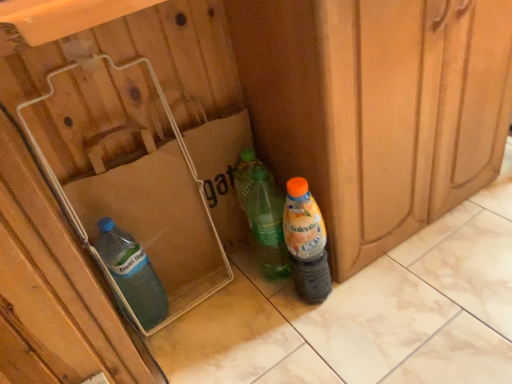
Question: Are translucent plastic bottle at lower right, the 1th bottle in the right-to-left sequence, and transparent plastic bottle at lower left, the 1th bottle positioned from the left, making contact?

Choices:
 (A) no
 (B) yes

Answer: (A)

Question: Is translucent plastic bottle at lower right, the second bottle positioned from the left, positioned far away from transparent plastic bottle at lower left, the 1th bottle positioned from the left?

Choices:
 (A) no
 (B) yes

Answer: (A)

Question: From the image's perspective, is translucent plastic bottle at lower right, the 1th bottle in the right-to-left sequence, below transparent plastic bottle at lower left, which appears as the second bottle when viewed from the right?

Choices:
 (A) yes
 (B) no

Answer: (B)

Question: Does translucent plastic bottle at lower right, the 1th bottle in the right-to-left sequence, have a larger size compared to transparent plastic bottle at lower left, the 1th bottle positioned from the left?

Choices:
 (A) yes
 (B) no

Answer: (A)

Question: Can you confirm if translucent plastic bottle at lower right, the second bottle positioned from the left, is positioned to the right of transparent plastic bottle at lower left, which appears as the second bottle when viewed from the right?

Choices:
 (A) yes
 (B) no

Answer: (A)

Question: In terms of width, does translucent plastic bottle at lower right, the 1th bottle in the right-to-left sequence, look wider or thinner when compared to translucent plastic box at lower left?

Choices:
 (A) thin
 (B) wide

Answer: (A)

Question: From a real-world perspective, is translucent plastic bottle at lower right, the 1th bottle in the right-to-left sequence, above or below translucent plastic box at lower left?

Choices:
 (A) above
 (B) below

Answer: (B)

Question: Visually, is translucent plastic bottle at lower right, the 1th bottle in the right-to-left sequence, positioned to the left or to the right of translucent plastic box at lower left?

Choices:
 (A) left
 (B) right

Answer: (B)

Question: Considering the positions of translucent plastic bottle at lower right, the 1th bottle in the right-to-left sequence, and translucent plastic box at lower left in the image, is translucent plastic bottle at lower right, the 1th bottle in the right-to-left sequence, bigger or smaller than translucent plastic box at lower left?

Choices:
 (A) small
 (B) big

Answer: (A)

Question: Considering the positions of point (72, 188) and point (115, 243), is point (72, 188) closer or farther from the camera than point (115, 243)?

Choices:
 (A) farther
 (B) closer

Answer: (B)

Question: In the image, is translucent plastic box at lower left positioned in front of or behind transparent plastic bottle at lower left, which appears as the second bottle when viewed from the right?

Choices:
 (A) behind
 (B) front

Answer: (B)

Question: Is translucent plastic box at lower left taller or shorter than transparent plastic bottle at lower left, which appears as the second bottle when viewed from the right?

Choices:
 (A) tall
 (B) short

Answer: (A)

Question: In terms of width, does translucent plastic box at lower left look wider or thinner when compared to transparent plastic bottle at lower left, the 1th bottle positioned from the left?

Choices:
 (A) wide
 (B) thin

Answer: (A)

Question: From the image's perspective, is transparent plastic bottle at lower left, the 1th bottle positioned from the left, above or below translucent plastic bottle at lower right, the 1th bottle in the right-to-left sequence?

Choices:
 (A) below
 (B) above

Answer: (A)

Question: Is transparent plastic bottle at lower left, which appears as the second bottle when viewed from the right, to the left or to the right of translucent plastic bottle at lower right, the second bottle positioned from the left, in the image?

Choices:
 (A) left
 (B) right

Answer: (A)